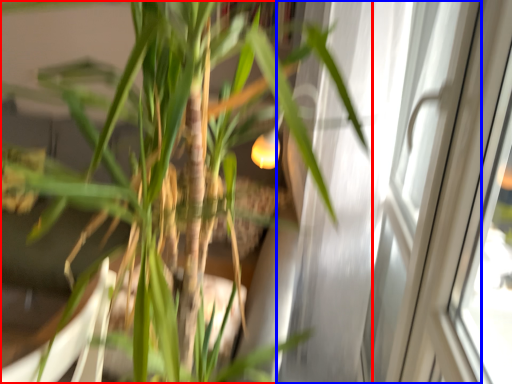
Question: Which object appears closest to the camera in this image, houseplant (highlighted by a red box) or screen door (highlighted by a blue box)?

Choices:
 (A) houseplant
 (B) screen door

Answer: (A)